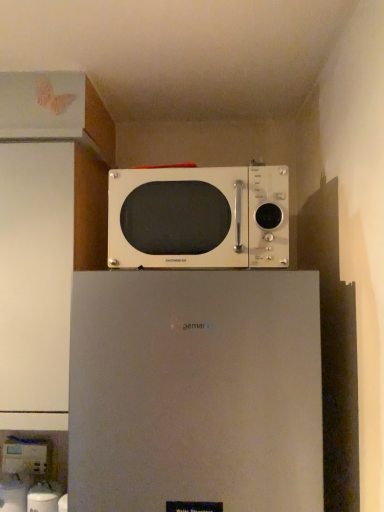
Question: Looking at the image, does white plastic water dispenser at lower left, placed as the 2th appliance when sorted from right to left, seem bigger or smaller compared to white glossy water dispenser at lower left, acting as the 1th appliance starting from the right?

Choices:
 (A) small
 (B) big

Answer: (A)

Question: Is white plastic water dispenser at lower left, the second appliance positioned from the front, situated inside white glossy water dispenser at lower left, which appears as the 2th appliance when viewed from the back, or outside?

Choices:
 (A) outside
 (B) inside

Answer: (A)

Question: Which object is positioned farthest from the white glossy water dispenser at lower left, which appears as the 2th appliance when viewed from the back?

Choices:
 (A) white plastic water dispenser at lower left, acting as the first appliance starting from the left
 (B) satin white refrigerator at upper center
 (C) white glossy microwave at upper center

Answer: (C)

Question: Which of these objects is positioned farthest from the satin white refrigerator at upper center?

Choices:
 (A) white plastic water dispenser at lower left, acting as the first appliance starting from the left
 (B) white glossy microwave at upper center
 (C) white glossy water dispenser at lower left, the first appliance positioned from the bottom

Answer: (A)